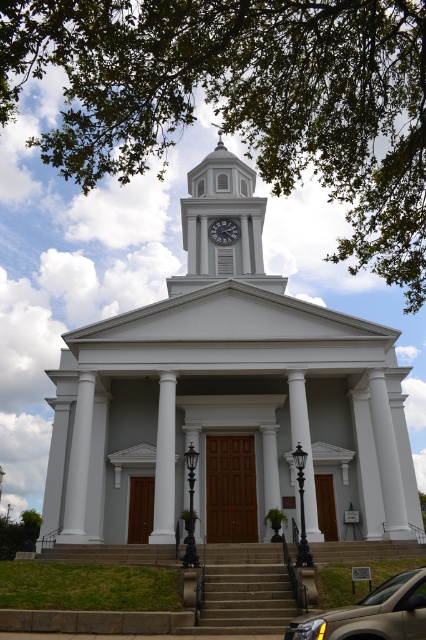
Can you confirm if green leafy tree at upper center is shorter than matte gold suv at lower center?

No.

Looking at this image, does green leafy tree at upper center appear on the right side of matte gold suv at lower center?

No, green leafy tree at upper center is not to the right of matte gold suv at lower center.

Is point (371, 182) farther from viewer compared to point (379, 605)?

Yes, point (371, 182) is farther from viewer.

Identify the location of green leafy tree at upper center. The height and width of the screenshot is (640, 426). (244, 99).

Who is positioned more to the right, brown stone stairs at center or white clock face at center?

brown stone stairs at center

Who is more distant from viewer, (236, 568) or (218, 234)?

The point (218, 234) is behind.

Locate an element on the screen. This screenshot has height=640, width=426. brown stone stairs at center is located at coordinates (244, 589).

Is white glossy clock tower at center positioned before brown stone stairs at center?

No, it is behind brown stone stairs at center.

You are a GUI agent. You are given a task and a screenshot of the screen. Output one action in this format:
    pyautogui.click(x=<x>, y=<y>)
    Task: Click on the white glossy clock tower at center
    
    Given the screenshot: What is the action you would take?
    pos(222,216)